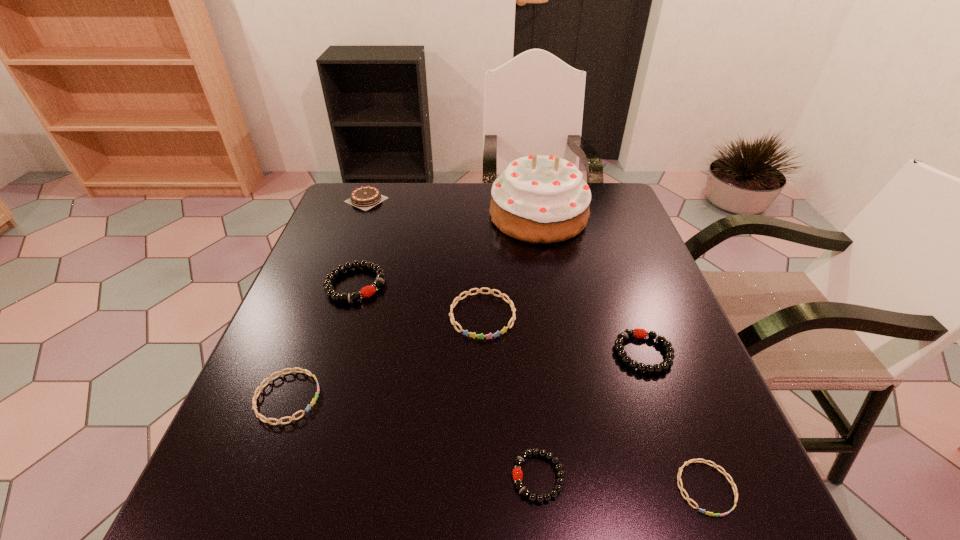
Where is `free space located on the front of the rightmost black bracelet`? free space located on the front of the rightmost black bracelet is located at coordinates (671, 432).

The width and height of the screenshot is (960, 540). I want to click on free location located 0.320m on the surface of the second biggest blue bracelet showing star-shaped elements, so click(489, 397).

The width and height of the screenshot is (960, 540). In order to click on free space located on the back of the nearest black bracelet in this screenshot , I will do `click(530, 391)`.

Locate an element on the screen. The width and height of the screenshot is (960, 540). cake that is positioned at the far edge is located at coordinates (543, 199).

Find the location of a particular element. chocolate cake that is at the far edge is located at coordinates [368, 196].

What are the coordinates of `chocolate cake situated at the left edge` in the screenshot? It's located at (368, 196).

This screenshot has height=540, width=960. I want to click on cake that is at the right edge, so click(x=543, y=199).

In order to click on object at the far left corner in this screenshot , I will do `click(368, 196)`.

Locate an element on the screen. The image size is (960, 540). object that is at the far right corner is located at coordinates (543, 199).

Image resolution: width=960 pixels, height=540 pixels. I want to click on object located in the near right corner section of the desktop, so click(x=687, y=498).